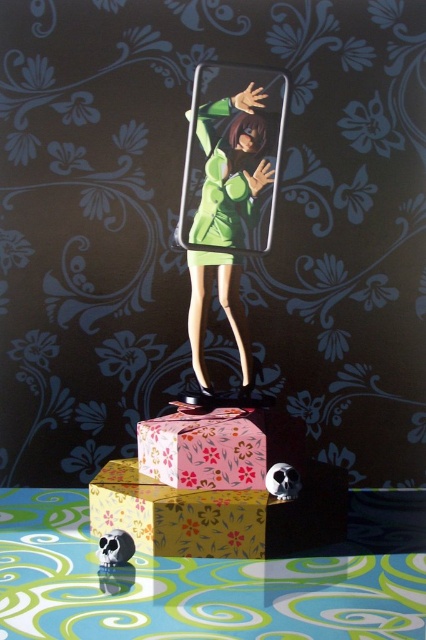
Question: Does green matte figure at center come behind matte black skull at lower left?

Choices:
 (A) no
 (B) yes

Answer: (B)

Question: Which point appears farthest from the camera in this image?

Choices:
 (A) (104, 545)
 (B) (232, 186)
 (C) (256, 413)
 (D) (198, 292)

Answer: (D)

Question: Does green matte figure at center appear under green matte dress at center?

Choices:
 (A) yes
 (B) no

Answer: (A)

Question: Does pink floral paper box at center have a greater width compared to matte black skull at lower left?

Choices:
 (A) yes
 (B) no

Answer: (A)

Question: Which object is closer to the camera taking this photo?

Choices:
 (A) pink floral paper box at center
 (B) green matte dress at center
 (C) green matte figure at center

Answer: (A)

Question: Among these points, which one is farthest from the camera?

Choices:
 (A) (209, 230)
 (B) (230, 452)

Answer: (A)